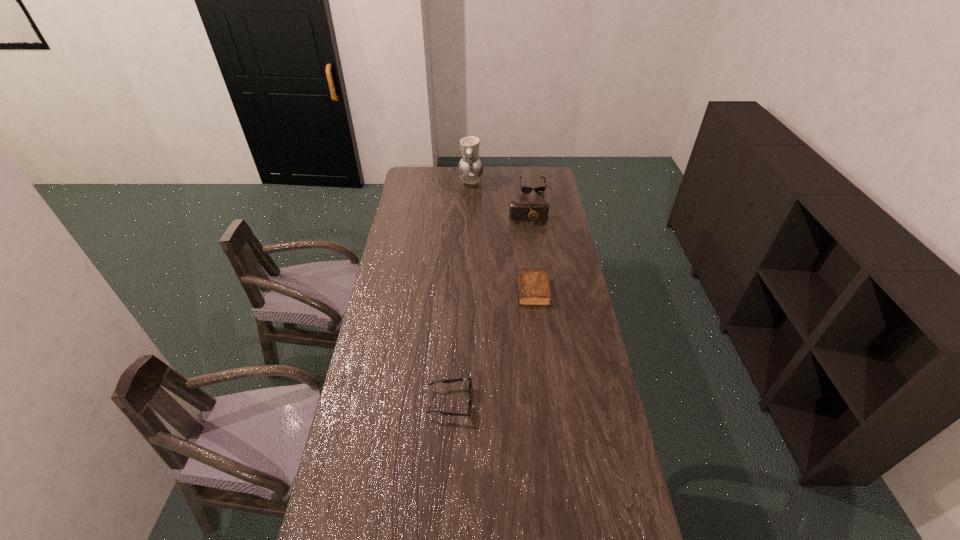
This screenshot has width=960, height=540. I want to click on the tallest object, so (470, 169).

The image size is (960, 540). I want to click on camera, so click(531, 210).

At what (x,y) coordinates should I click in order to perform the action: click on the fourth shortest object. Please return your answer as a coordinate pair (x, y). This screenshot has height=540, width=960. Looking at the image, I should click on (531, 210).

You are a GUI agent. You are given a task and a screenshot of the screen. Output one action in this format:
    pyautogui.click(x=<x>, y=<y>)
    Task: Click on the right sunglasses
    
    Given the screenshot: What is the action you would take?
    pyautogui.click(x=524, y=189)

Locate an element on the screen. The width and height of the screenshot is (960, 540). the second nearest object is located at coordinates (533, 287).

Where is `the nearest object`? the nearest object is located at coordinates (470, 388).

At what (x,y) coordinates should I click in order to perform the action: click on the left sunglasses. Please return your answer as a coordinate pair (x, y). Looking at the image, I should click on (470, 388).

Where is `blank space located 0.280m on either side of the pottery`? The width and height of the screenshot is (960, 540). blank space located 0.280m on either side of the pottery is located at coordinates (534, 183).

This screenshot has width=960, height=540. Identify the location of vacant area situated 0.270m on the front-facing side of the fourth shortest object. (535, 261).

In order to click on vacant space situated 0.380m on the front-facing side of the farther sunglasses in this screenshot , I will do `click(540, 239)`.